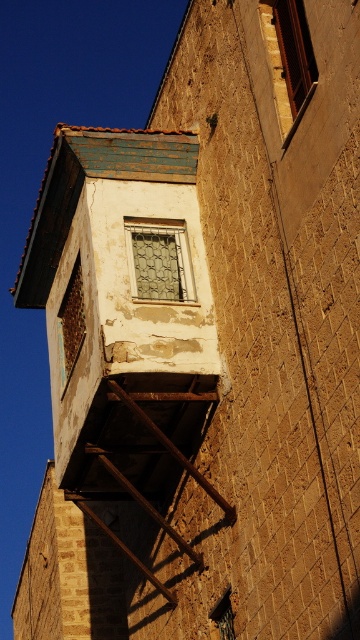
You are a construction worker assessing the building. You need to access the rusty metal window at center for repairs. Is the rusty metal fire escape at lower center positioned in a way that could provide safe access to the window?

The rusty metal fire escape at lower center is located below the rusty metal window at center, so it can be used to safely reach the window for repairs.

You are standing at the point marked as point (144,444) in the image. What object are you currently positioned on?

You are positioned on the rusty metal fire escape at lower center, as the coordinates point (144,444) correspond to this object.

You are a painter assessing the building to estimate the area of the rusty metal fire escape at lower left and the rusty metal fire escape at lower center. Which one requires more paint if they are both the same height?

The rusty metal fire escape at lower left might require more paint than the rusty metal fire escape at lower center because it is wider.